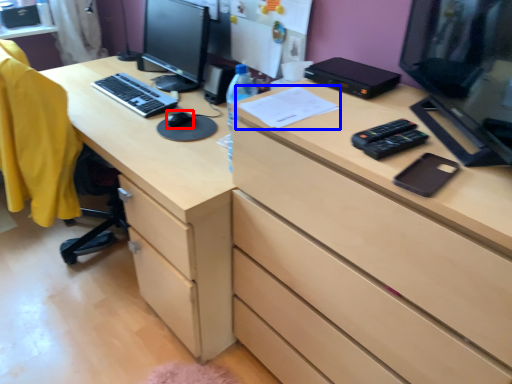
Question: Which object is closer to the camera taking this photo, mouse (highlighted by a red box) or paper (highlighted by a blue box)?

Choices:
 (A) mouse
 (B) paper

Answer: (B)